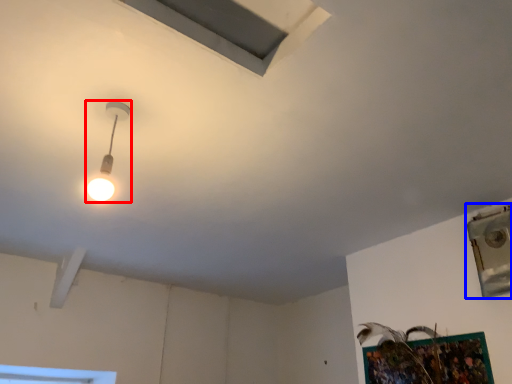
Question: Which of the following is the closest to the observer, lamp (highlighted by a red box) or window (highlighted by a blue box)?

Choices:
 (A) lamp
 (B) window

Answer: (A)